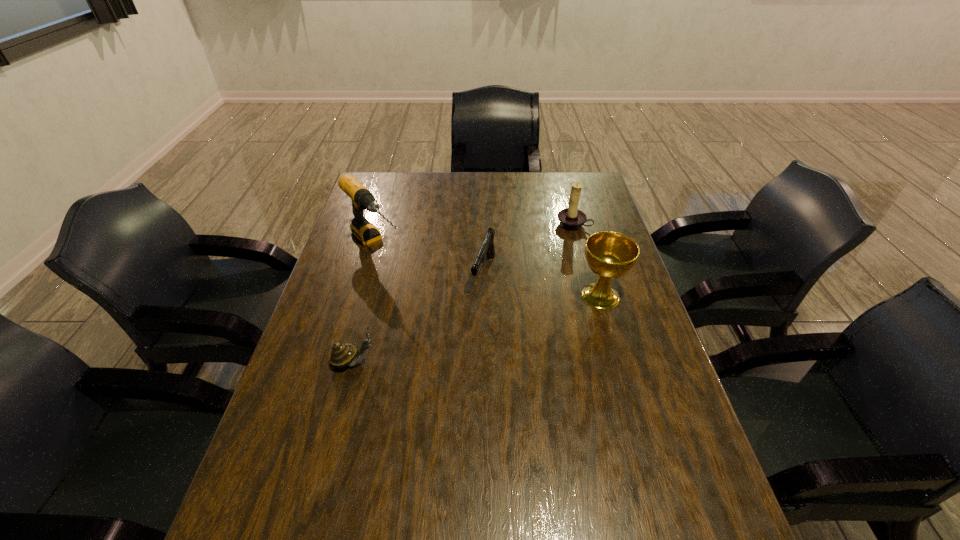
Locate an element on the screen. The height and width of the screenshot is (540, 960). snail is located at coordinates (342, 355).

Identify the location of chalice. The height and width of the screenshot is (540, 960). (610, 255).

Where is `candle holder`? The image size is (960, 540). candle holder is located at coordinates (571, 218).

The image size is (960, 540). Find the location of `gun`. gun is located at coordinates (487, 249).

I want to click on drill, so click(362, 199).

Locate an element on the screen. The width and height of the screenshot is (960, 540). vacant space situated on the face of the snail is located at coordinates (540, 362).

I want to click on vacant space located on the left of the chalice, so click(441, 296).

The image size is (960, 540). Find the location of `blank space located 0.060m on the wick of the candle holder`. blank space located 0.060m on the wick of the candle holder is located at coordinates (x=559, y=240).

Where is `free space located 0.050m on the wick of the candle holder`? free space located 0.050m on the wick of the candle holder is located at coordinates (560, 239).

Identify the location of vacant area situated 0.050m on the wick of the candle holder. (560, 239).